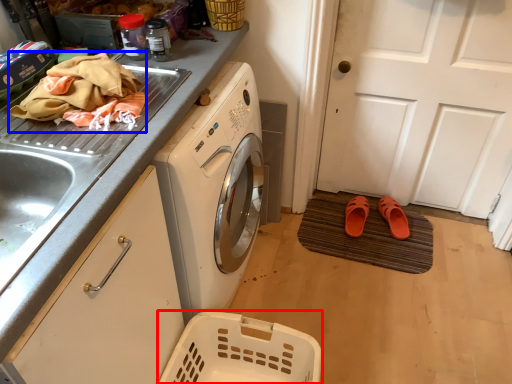
Question: Which object is closer to the camera taking this photo, basket (highlighted by a red box) or material (highlighted by a blue box)?

Choices:
 (A) basket
 (B) material

Answer: (B)